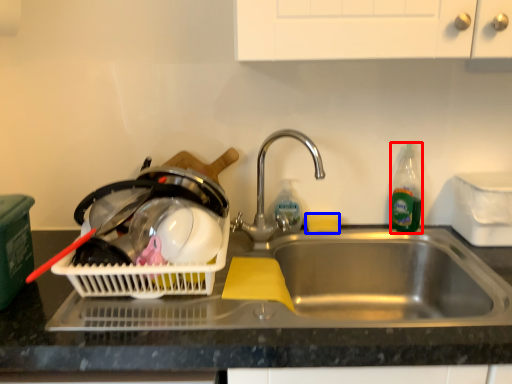
Question: Among these objects, which one is farthest to the camera, bottle (highlighted by a red box) or food (highlighted by a blue box)?

Choices:
 (A) bottle
 (B) food

Answer: (B)